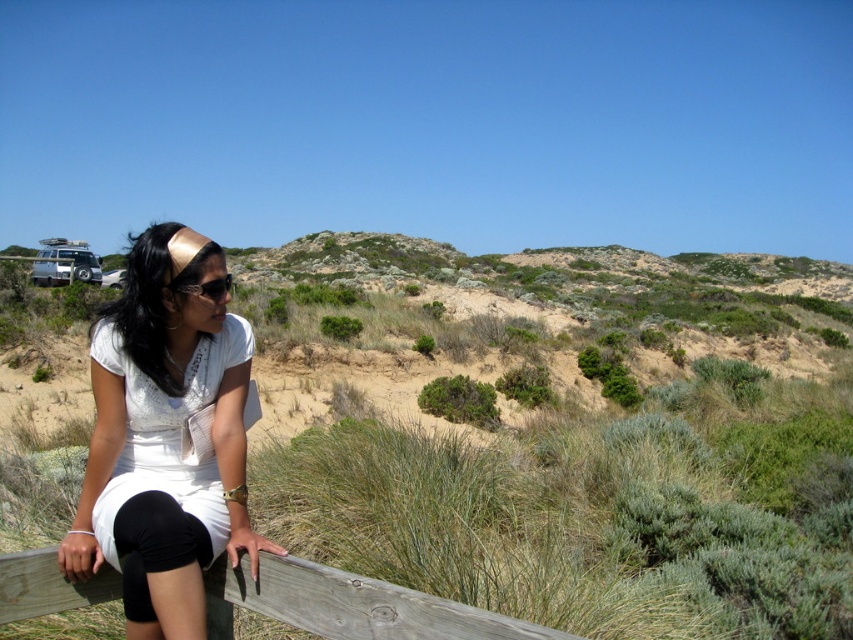
Between white matte dress at center and wooden at lower left, which one appears on the right side from the viewer's perspective?

wooden at lower left

Can you confirm if white matte dress at center is taller than wooden at lower left?

Yes.

Which is in front, point (148, 348) or point (207, 586)?

Point (207, 586)

This screenshot has height=640, width=853. Identify the location of white matte dress at center. (165, 436).